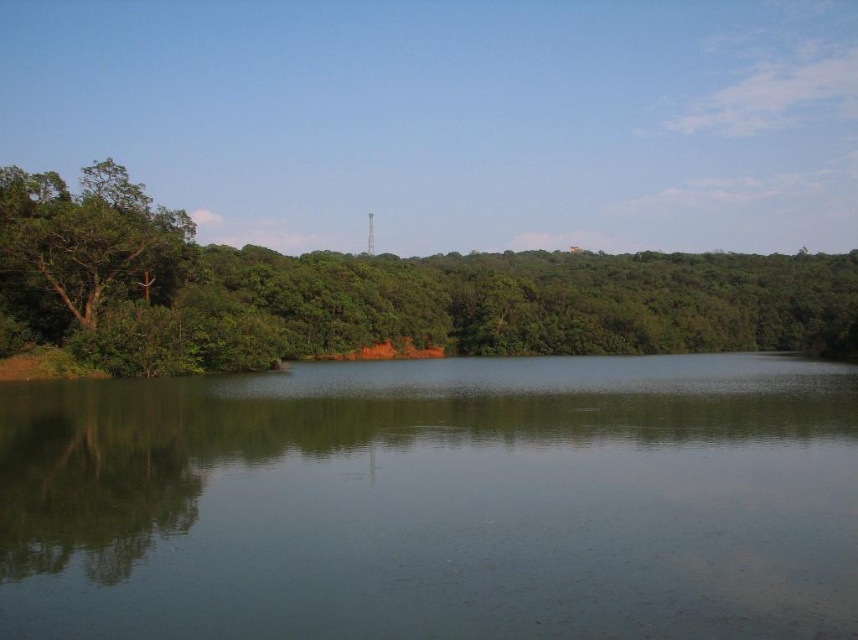
Can you confirm if green smooth water at center is smaller than green matte tree at left?

Yes.

Is green smooth water at center positioned before green matte tree at left?

Yes, it is in front of green matte tree at left.

Between point (801, 580) and point (76, 276), which one is positioned behind?

The point (76, 276) is behind.

Find the location of a particular element. green smooth water at center is located at coordinates (436, 502).

Can you confirm if green leafy tree at left is wider than green matte tree at left?

Yes.

Which is more to the right, green leafy tree at left or green matte tree at left?

green leafy tree at left is more to the right.

The height and width of the screenshot is (640, 858). Identify the location of green leafy tree at left. point(373,291).

Does point (566, 376) lie in front of point (609, 304)?

Yes, point (566, 376) is in front of point (609, 304).

Is green smooth water at center thinner than green leafy tree at left?

Correct, green smooth water at center's width is less than green leafy tree at left's.

Does point (608, 563) come farther from viewer compared to point (121, 209)?

No.

This screenshot has width=858, height=640. Identify the location of green smooth water at center. (436, 502).